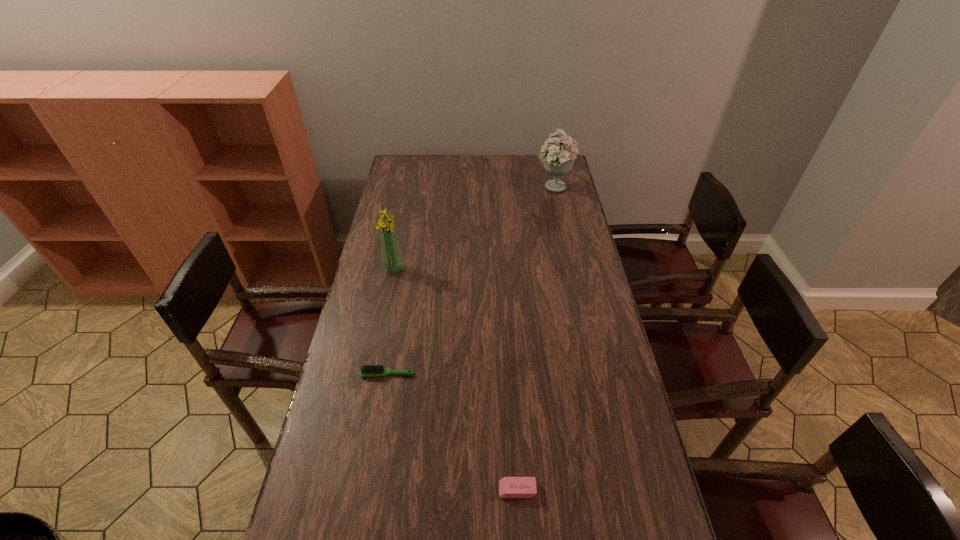
Locate an element on the screen. This screenshot has height=540, width=960. vacant space in between the second nearest object and the nearer bouquet is located at coordinates (391, 321).

Where is `vacant region between the second nearest object and the nearest object`? The image size is (960, 540). vacant region between the second nearest object and the nearest object is located at coordinates (452, 431).

This screenshot has width=960, height=540. Find the location of `vacant region between the farther bouquet and the eraser`. vacant region between the farther bouquet and the eraser is located at coordinates (536, 339).

At what (x,y) coordinates should I click in order to perform the action: click on free space between the hairbrush and the second object from right to left. Please return your answer as a coordinate pair (x, y). The image size is (960, 540). Looking at the image, I should click on (452, 431).

Where is `free space between the nearer bouquet and the third object from left to right`? This screenshot has height=540, width=960. free space between the nearer bouquet and the third object from left to right is located at coordinates (456, 380).

Find the location of a particular element. vacant area that lies between the eraser and the nearer bouquet is located at coordinates (456, 380).

Identify the location of free space between the left bouquet and the hairbrush. (391, 321).

The width and height of the screenshot is (960, 540). I want to click on free space between the hairbrush and the farthest object, so click(x=470, y=281).

What are the coordinates of `blank region between the third object from left to right and the hairbrush` in the screenshot? It's located at (452, 431).

Identify which object is the third closest to the hairbrush. Please provide its 2D coordinates. Your answer should be formatted as a tuple, i.e. [(x, y)], where the tuple contains the x and y coordinates of a point satisfying the conditions above.

[(558, 160)]